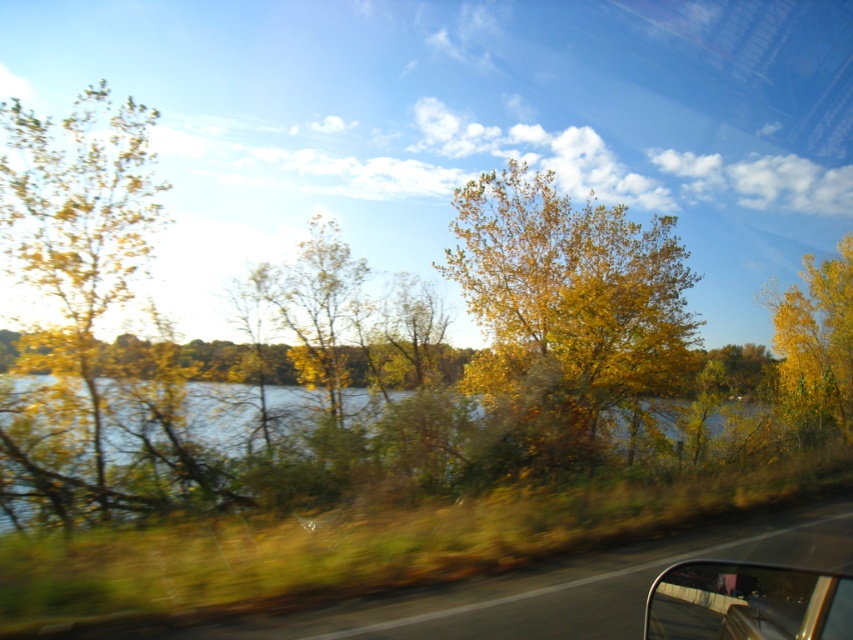
You are sitting in the driver seat of the vehicle and looking out the window. There are two points marked on the window. One is at coordinate point [206,468] and the other is at coordinate point [827,272]. Which point is closer to you?

Point [206,468] is closer to the camera than point [827,272].